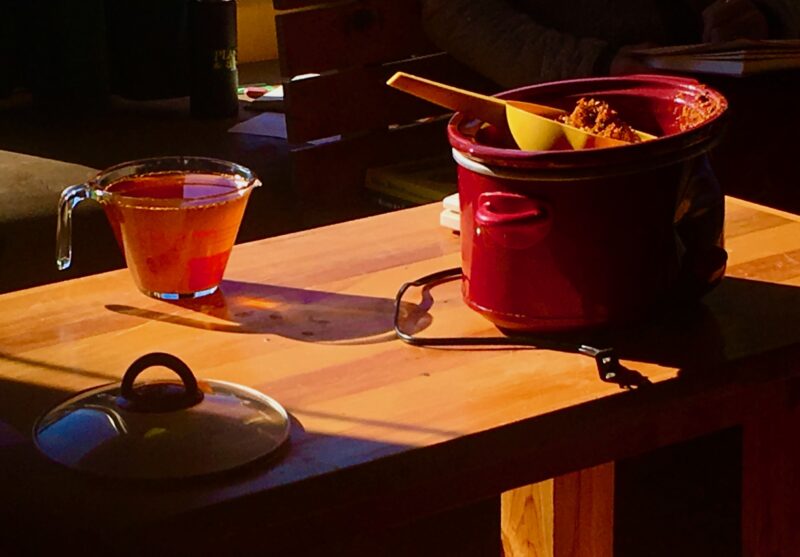
This screenshot has width=800, height=557. I want to click on lid handle, so (x=154, y=356).